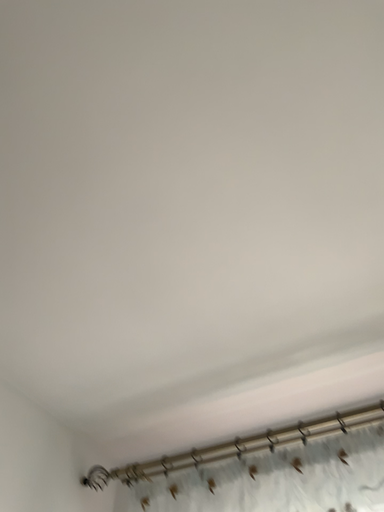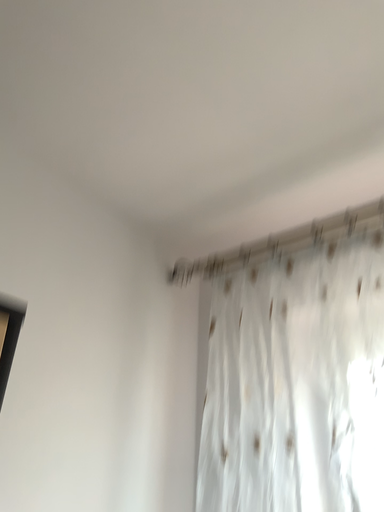
Question: How did the camera likely rotate when shooting the video?

Choices:
 (A) rotated downward
 (B) rotated upward

Answer: (A)